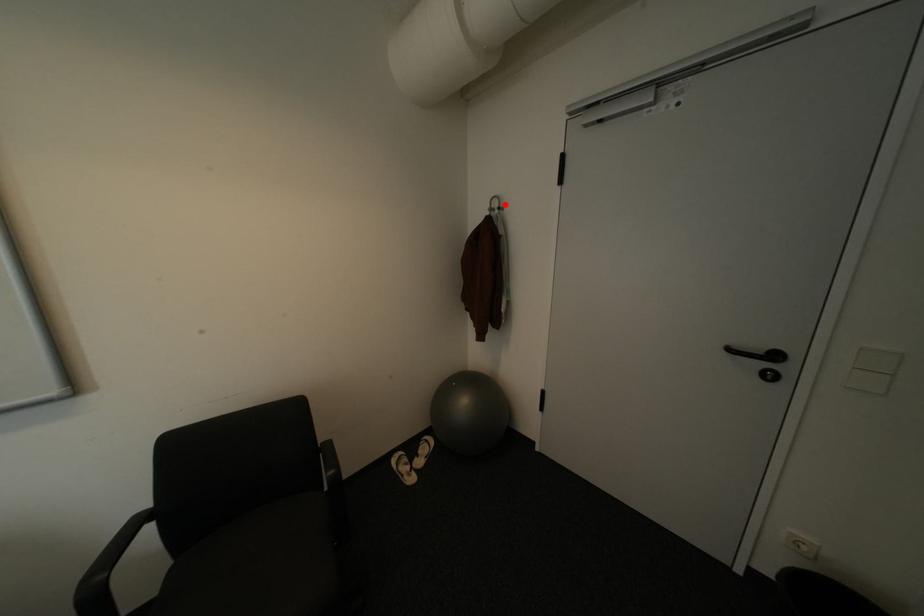
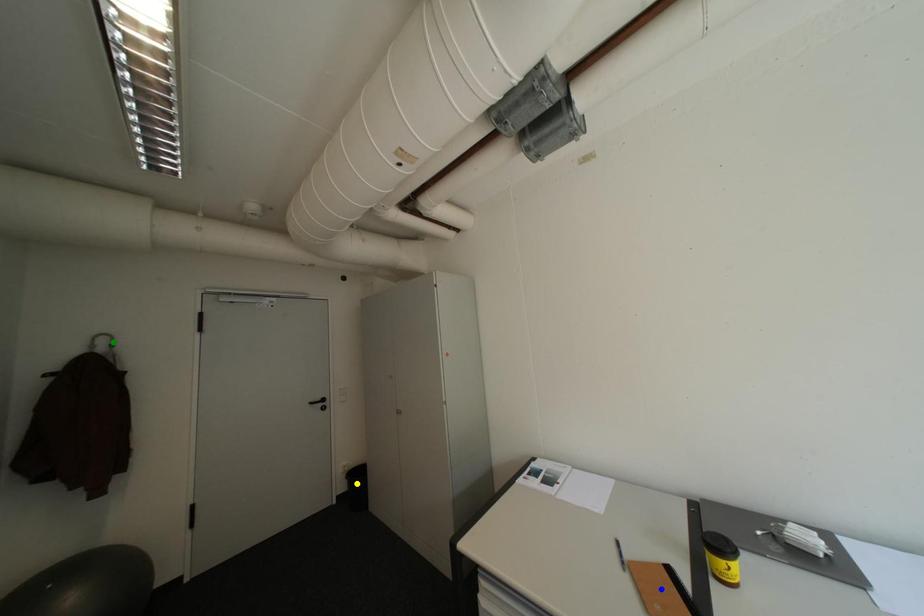
Question: I am providing you with two images of the same scene from different viewpoints. A red point is marked on the first image. You are given multiple points on the second image. Which spot in image 2 lines up with the point in image 1?

Choices:
 (A) green point
 (B) blue point
 (C) yellow point

Answer: (A)